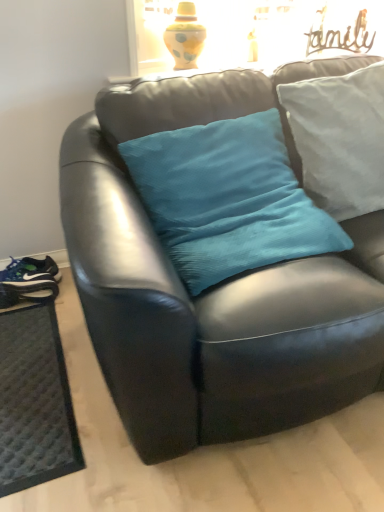
Question: Is matte black running shoe at lower left bigger than teal fabric pillow at center, which appears as the second pillow when viewed from the right?

Choices:
 (A) no
 (B) yes

Answer: (A)

Question: Is matte black running shoe at lower left located outside teal fabric pillow at center, the 1th pillow positioned from the left?

Choices:
 (A) no
 (B) yes

Answer: (B)

Question: Does matte black running shoe at lower left have a smaller size compared to teal fabric pillow at center, the 1th pillow positioned from the left?

Choices:
 (A) yes
 (B) no

Answer: (A)

Question: Would you say matte black running shoe at lower left contains teal fabric pillow at center, which appears as the second pillow when viewed from the right?

Choices:
 (A) yes
 (B) no

Answer: (B)

Question: Are matte black running shoe at lower left and teal fabric pillow at center, which appears as the second pillow when viewed from the right, beside each other?

Choices:
 (A) no
 (B) yes

Answer: (A)

Question: From a real-world perspective, is matte black running shoe at lower left under teal fabric pillow at center, which appears as the second pillow when viewed from the right?

Choices:
 (A) no
 (B) yes

Answer: (B)

Question: Does blue synthetic shoe at lower left lie behind teal fabric pillow at center, the 1th pillow from the right?

Choices:
 (A) no
 (B) yes

Answer: (B)

Question: Is blue synthetic shoe at lower left at the right side of teal fabric pillow at center, the 1th pillow from the right?

Choices:
 (A) no
 (B) yes

Answer: (A)

Question: Considering the relative positions of blue synthetic shoe at lower left and teal fabric pillow at center, the 1th pillow from the right, in the image provided, is blue synthetic shoe at lower left to the left of teal fabric pillow at center, the 1th pillow from the right, from the viewer's perspective?

Choices:
 (A) yes
 (B) no

Answer: (A)

Question: Considering the relative positions of blue synthetic shoe at lower left and teal fabric pillow at center, which appears as the 2th pillow when viewed from the left, in the image provided, is blue synthetic shoe at lower left in front of teal fabric pillow at center, which appears as the 2th pillow when viewed from the left,?

Choices:
 (A) no
 (B) yes

Answer: (A)

Question: Is blue synthetic shoe at lower left looking in the opposite direction of teal fabric pillow at center, which appears as the 2th pillow when viewed from the left?

Choices:
 (A) yes
 (B) no

Answer: (B)

Question: Does blue synthetic shoe at lower left touch teal fabric pillow at center, the 1th pillow from the right?

Choices:
 (A) no
 (B) yes

Answer: (A)

Question: Considering the relative sizes of matte black couch at center and dark gray textured mat at lower left in the image provided, is matte black couch at center bigger than dark gray textured mat at lower left?

Choices:
 (A) no
 (B) yes

Answer: (B)